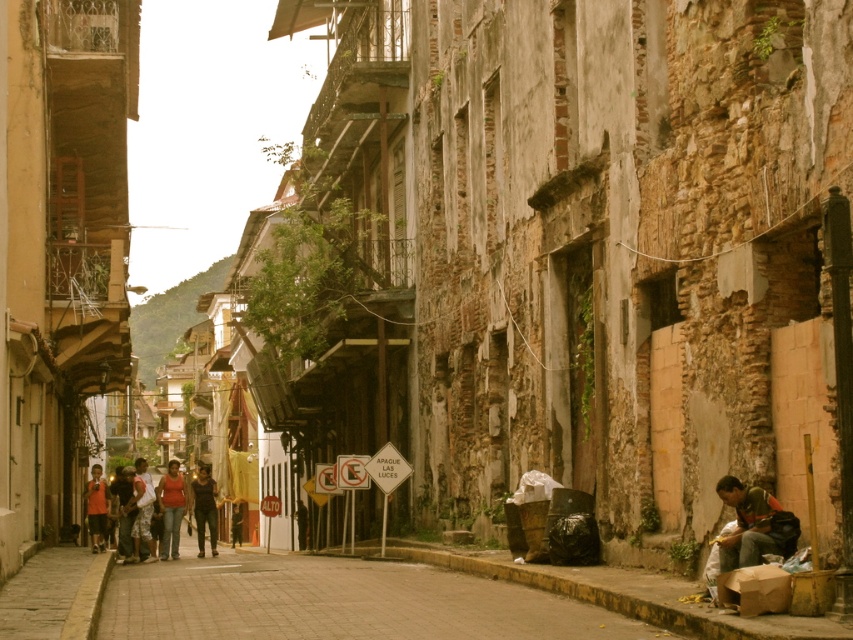
Is the position of green fabric bag at lower right less distant than that of matte red shirt at center?

Yes.

Who is higher up, green fabric bag at lower right or matte red shirt at center?

green fabric bag at lower right

Does point (730, 544) come in front of point (164, 486)?

Yes.

Locate an element on the screen. The height and width of the screenshot is (640, 853). green fabric bag at lower right is located at coordinates (753, 525).

Who is shorter, green fabric bag at lower right or matte black shirt at center?

With less height is green fabric bag at lower right.

At what (x,y) coordinates should I click in order to perform the action: click on green fabric bag at lower right. Please return your answer as a coordinate pair (x, y). The image size is (853, 640). Looking at the image, I should click on (753, 525).

Is point (747, 563) farther from viewer compared to point (166, 480)?

No, it is in front of (166, 480).

I want to click on green fabric bag at lower right, so click(x=753, y=525).

Which is more to the right, brown brick pavement at center or dark brown leather jacket at center?

From the viewer's perspective, brown brick pavement at center appears more on the right side.

Looking at this image, can you confirm if brown brick pavement at center is positioned above dark brown leather jacket at center?

Indeed, brown brick pavement at center is positioned over dark brown leather jacket at center.

Between point (520, 602) and point (196, 484), which one is positioned in front?

Point (520, 602)

I want to click on brown brick pavement at center, so click(339, 602).